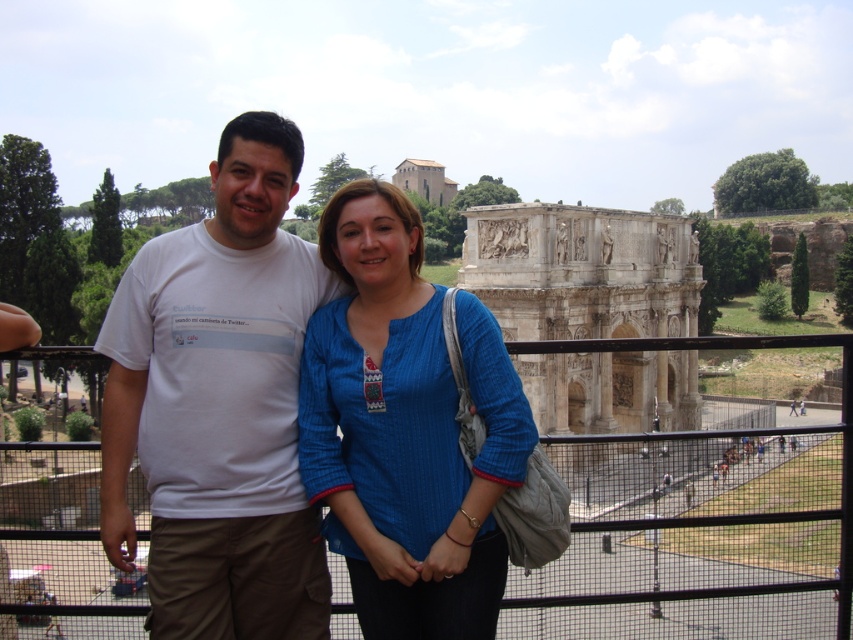
Question: Which point appears farthest from the camera in this image?

Choices:
 (A) (200, 348)
 (B) (415, 499)

Answer: (A)

Question: Which object is farther from the camera taking this photo?

Choices:
 (A) blue ribbed shirt at center
 (B) white cotton t-shirt at center

Answer: (A)

Question: Is white cotton t-shirt at center wider than blue ribbed shirt at center?

Choices:
 (A) no
 (B) yes

Answer: (B)

Question: Is white cotton t-shirt at center above blue ribbed shirt at center?

Choices:
 (A) yes
 (B) no

Answer: (A)

Question: Can you confirm if white cotton t-shirt at center is wider than blue ribbed shirt at center?

Choices:
 (A) yes
 (B) no

Answer: (A)

Question: Which of the following is the closest to the observer?

Choices:
 (A) (234, 140)
 (B) (424, 378)

Answer: (B)